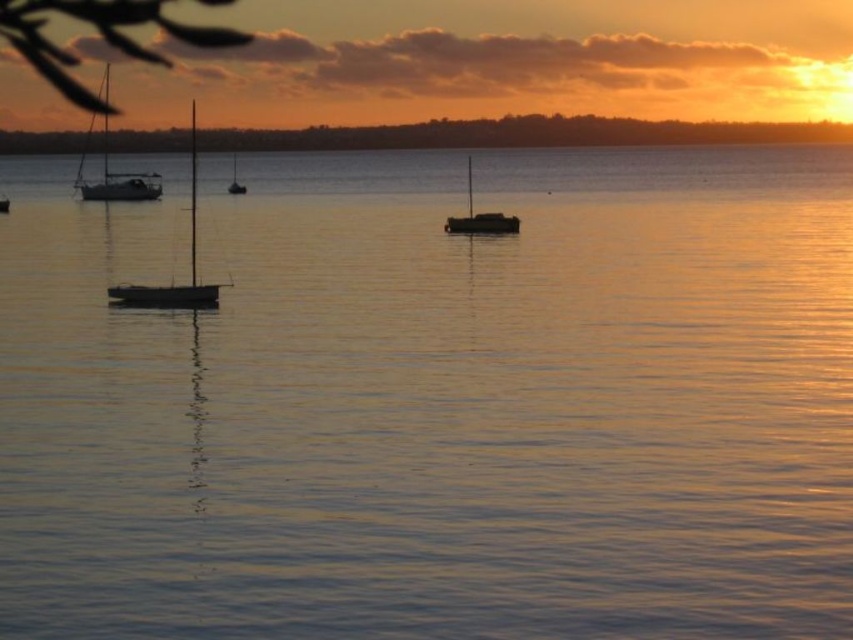
You are standing on the shore of the lake and see two points reflected on the water surface. The first point is at coordinate point [90,186] and the second is at point [454,221]. Which point appears closer to you when looking at the reflections?

Point [90,186] is further to the camera than point [454,221], so the point at [454,221] appears closer to you.

You are a photographer positioned at the center of the image. You want to capture a closeup shot of the silvery metallic sailboat at left. Which direction should you move your camera to focus on it?

You should move your camera to the left to focus on the silvery metallic sailboat at left since it is located at the left side of the image.

You are a marine biologist planning to place a buoy between the dark brown wooden boat at center and the shiny silver sailboat at center. The buoy has a diameter of 1 foot. Can you safely place the buoy between them without it touching either boat?

The dark brown wooden boat at center and shiny silver sailboat at center are 122.41 feet apart. Since the buoy has a diameter of 1 foot, there is sufficient space between the two boats to place the buoy without it touching either boat.